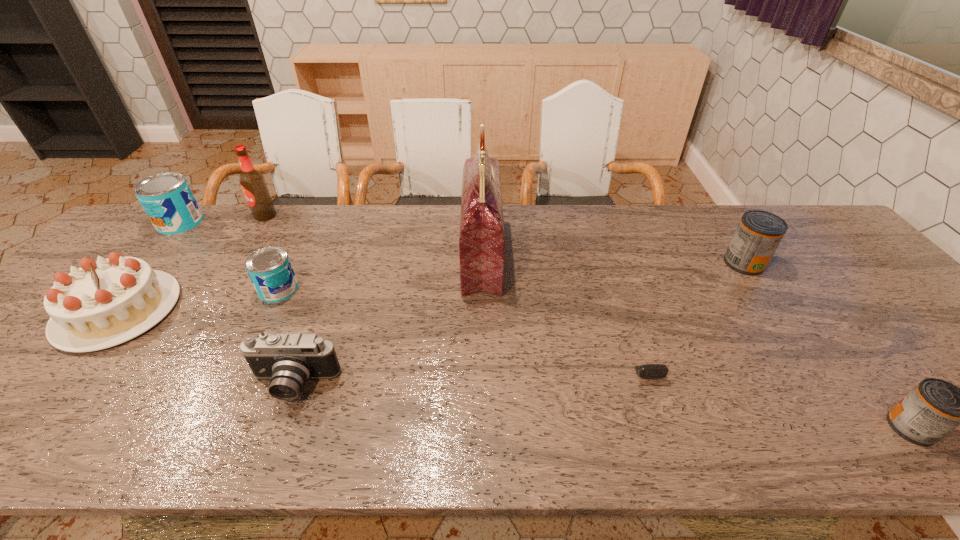
Identify the location of handbag. (481, 239).

Where is `the sixth object from left to right`? the sixth object from left to right is located at coordinates (481, 239).

I want to click on the third object from left to right, so click(253, 183).

Find the location of `beer bottle`. beer bottle is located at coordinates (253, 183).

This screenshot has width=960, height=540. What are the coordinates of `the leftmost can` in the screenshot? It's located at (167, 199).

Identify the location of the farthest can. (167, 199).

The width and height of the screenshot is (960, 540). Find the location of `the farther red can`. the farther red can is located at coordinates (759, 233).

Locate an element on the screen. This screenshot has height=540, width=960. the eighth object from left to right is located at coordinates (759, 233).

I want to click on birthday cake, so click(101, 304).

Locate an element on the screen. The width and height of the screenshot is (960, 540). black camera is located at coordinates (289, 360).